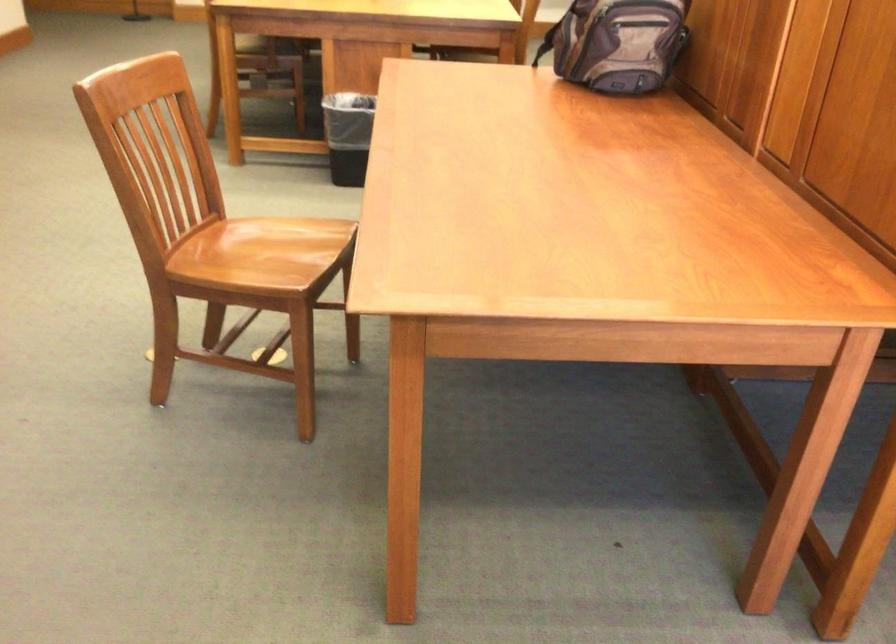
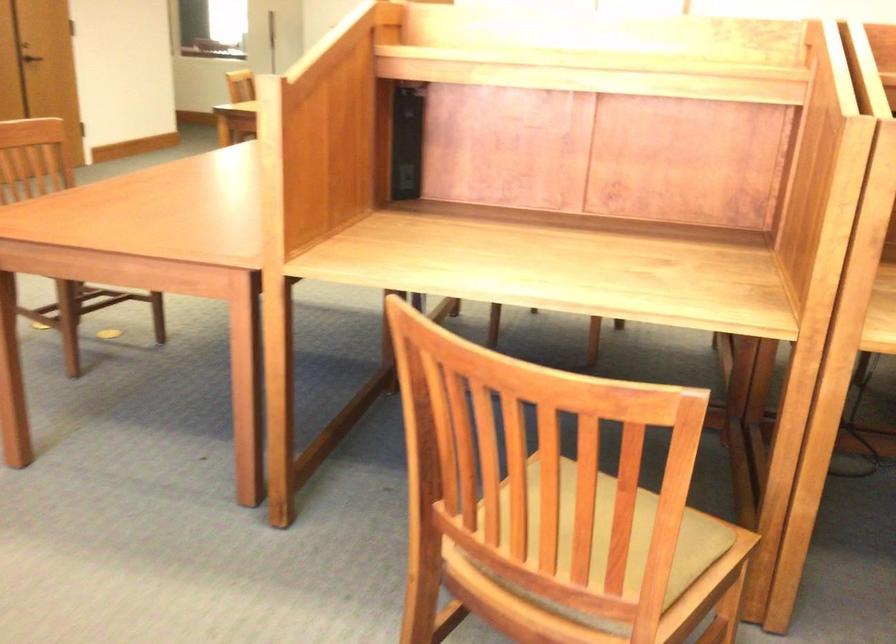
Question: I am providing you with two images of the same scene from different viewpoints. After the viewpoint changes to image2, which objects are now occluded?

Choices:
 (A) grey chair cushion
 (B) black trash can
 (C) metal door handle
 (D) chair sitting surface

Answer: (B)